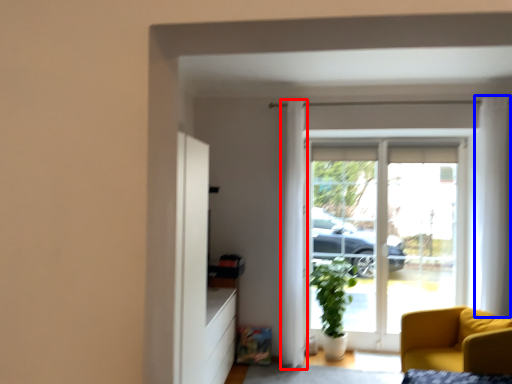
Question: Which object appears farthest to the camera in this image, curtain (highlighted by a red box) or curtain (highlighted by a blue box)?

Choices:
 (A) curtain
 (B) curtain

Answer: (A)